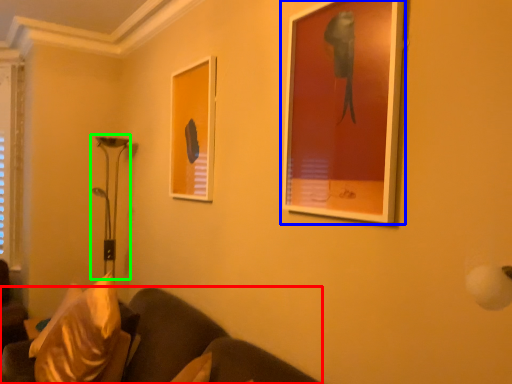
Question: Based on their relative distances, which object is nearer to studio couch (highlighted by a red box)? Choose from picture frame (highlighted by a blue box) and table lamp (highlighted by a green box).

Choices:
 (A) picture frame
 (B) table lamp

Answer: (A)